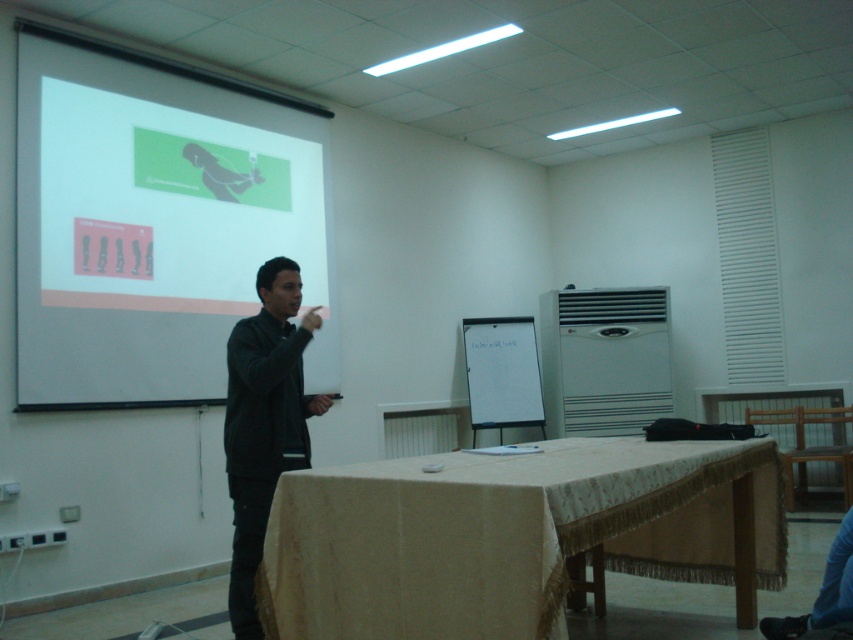
Question: Which object is closer to the camera taking this photo?

Choices:
 (A) black matte jacket at center
 (B) beige fabric-covered table at center
 (C) white matte projection screen at upper left

Answer: (B)

Question: Can you confirm if beige fabric-covered table at center is bigger than white matte flipchart at center?

Choices:
 (A) yes
 (B) no

Answer: (A)

Question: Which point is closer to the camera?

Choices:
 (A) beige fabric-covered table at center
 (B) white matte flipchart at center
 (C) white matte projection screen at upper left

Answer: (A)

Question: Is beige fabric-covered table at center bigger than black matte jacket at center?

Choices:
 (A) yes
 (B) no

Answer: (A)

Question: Can you confirm if white matte projection screen at upper left is positioned above black matte jacket at center?

Choices:
 (A) yes
 (B) no

Answer: (A)

Question: Among these objects, which one is farthest from the camera?

Choices:
 (A) black matte jacket at center
 (B) white matte projection screen at upper left

Answer: (B)